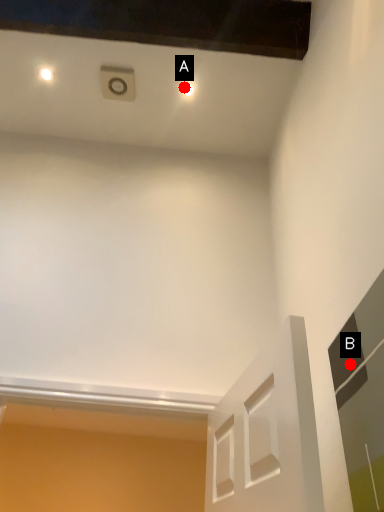
Question: Two points are circled on the image, labeled by A and B beside each circle. Which point is farther from the camera taking this photo?

Choices:
 (A) A is further
 (B) B is further

Answer: (A)